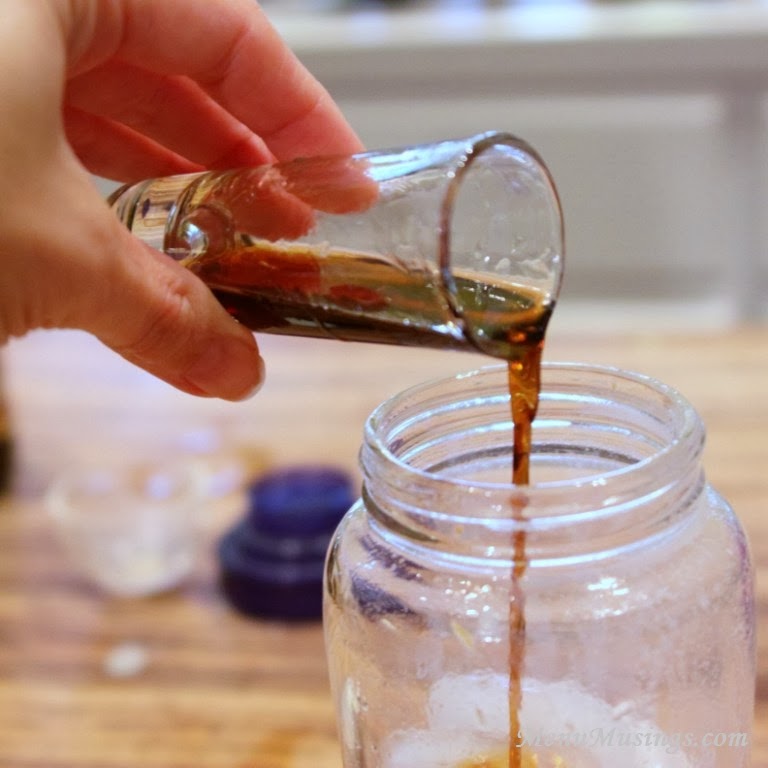
Find the location of a particular element. This screenshot has height=768, width=768. jar is located at coordinates (663, 541), (368, 574).